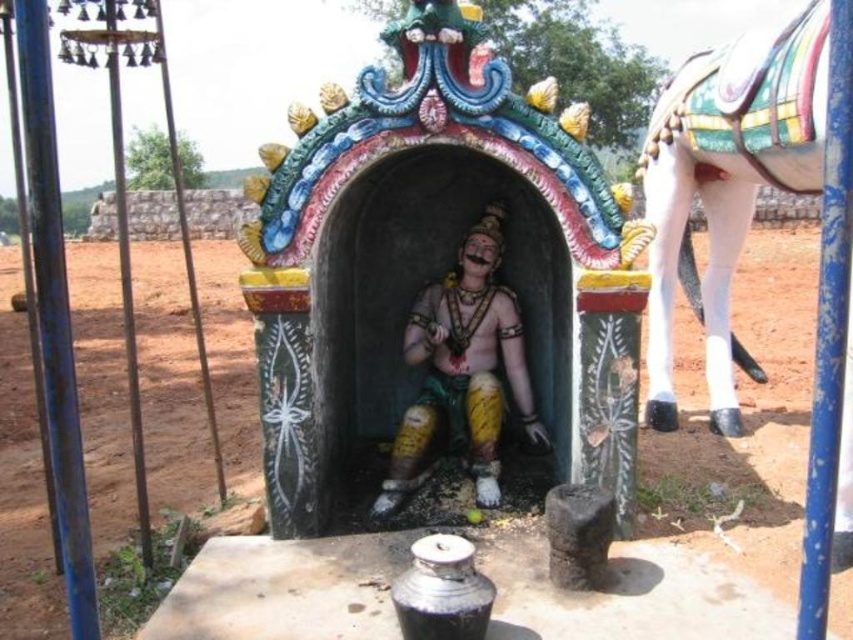
The image size is (853, 640). What do you see at coordinates (727, 179) in the screenshot?
I see `white glossy horse at right` at bounding box center [727, 179].

Who is more distant from viewer, (764,64) or (451,355)?

The point (451,355) is more distant.

Between point (762, 115) and point (512, 337), which one is positioned behind?

Point (512, 337)

Identify the location of white glossy horse at right. The width and height of the screenshot is (853, 640). (727, 179).